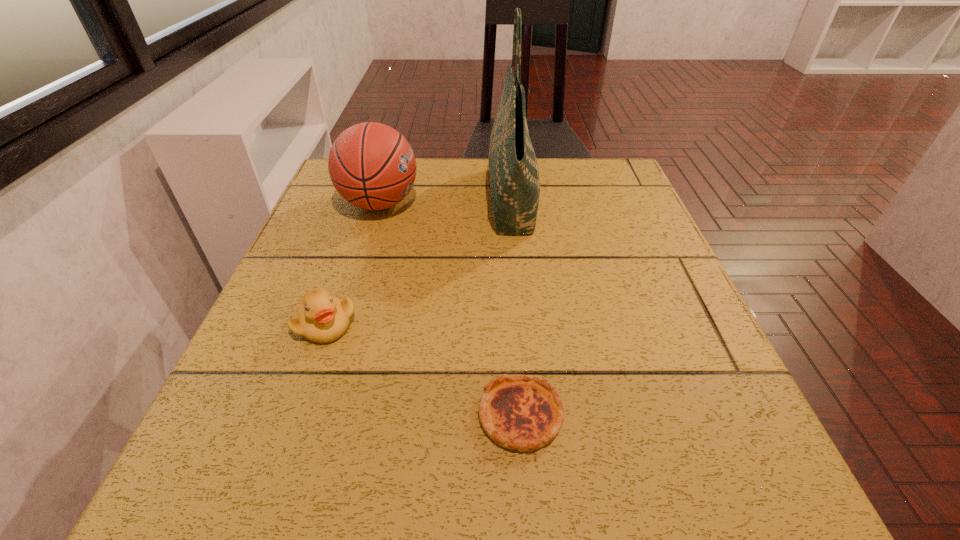
Identify the location of tote bag located in the far edge section of the desktop. (514, 174).

This screenshot has width=960, height=540. What are the coordinates of `basketball present at the far edge` in the screenshot? It's located at (371, 165).

Locate an element on the screen. object situated at the near edge is located at coordinates (521, 412).

At what (x,y) coordinates should I click in order to perform the action: click on basketball that is positioned at the left edge. Please return your answer as a coordinate pair (x, y). The image size is (960, 540). Looking at the image, I should click on (371, 165).

At what (x,y) coordinates should I click in order to perform the action: click on duckling that is at the left edge. Please return your answer as a coordinate pair (x, y). This screenshot has height=540, width=960. Looking at the image, I should click on (321, 318).

Where is `object located in the far left corner section of the desktop`? Image resolution: width=960 pixels, height=540 pixels. object located in the far left corner section of the desktop is located at coordinates (371, 165).

This screenshot has height=540, width=960. Identify the location of vacant space at the far edge of the desktop. (550, 190).

Where is `vacant space at the near edge of the desktop`? This screenshot has width=960, height=540. vacant space at the near edge of the desktop is located at coordinates (515, 463).

Find the location of a particular element. free region at the left edge of the desktop is located at coordinates (372, 215).

In the image, there is a desktop. What are the coordinates of `vacant area at the right edge` in the screenshot? It's located at (607, 239).